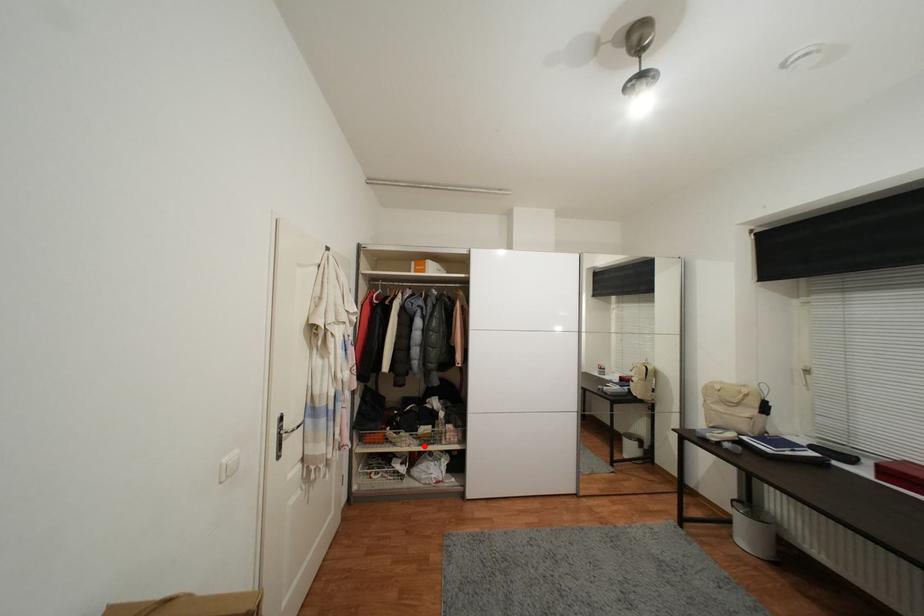
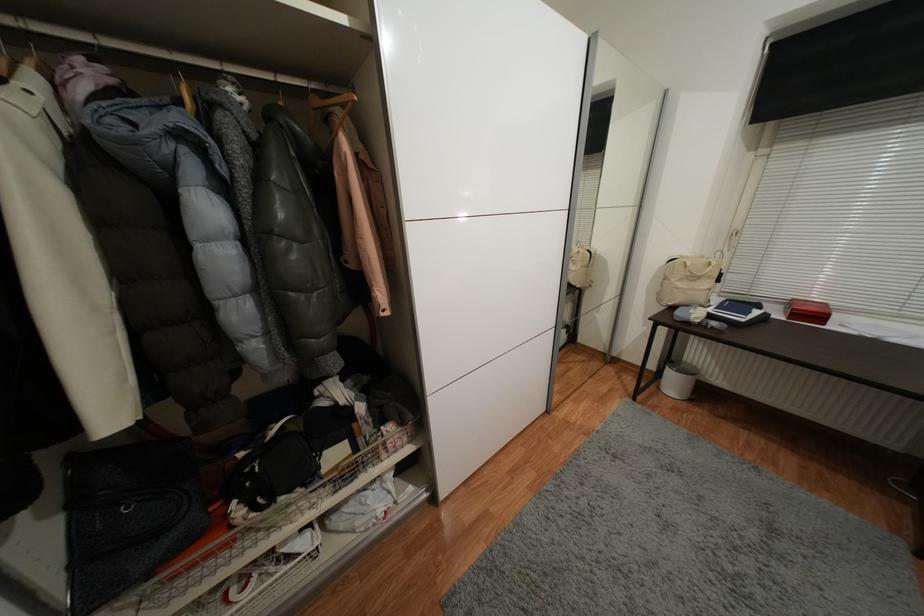
Question: I am providing you with two images of the same scene from different viewpoints. In image1, a red point is highlighted. Considering the same 3D point in image2, which of the following is correct?

Choices:
 (A) It is closer
 (B) It is farther

Answer: (A)